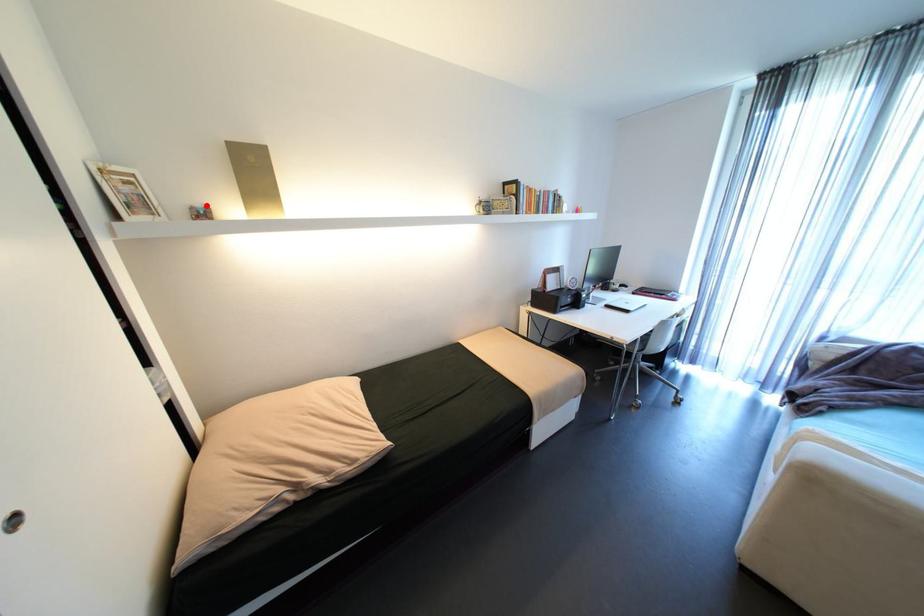
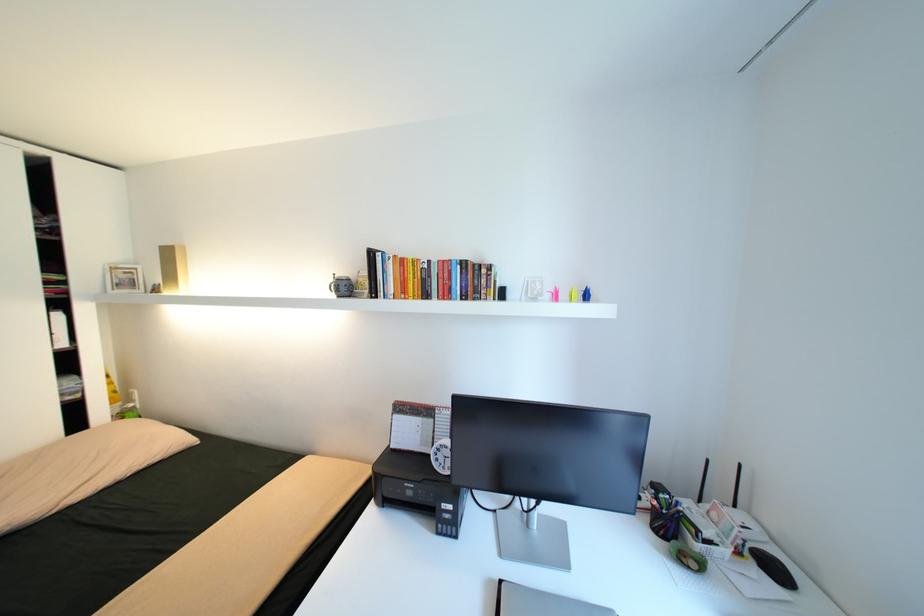
Find the pixel in the second image that matches the highlighted location in the first image.

(164, 284)